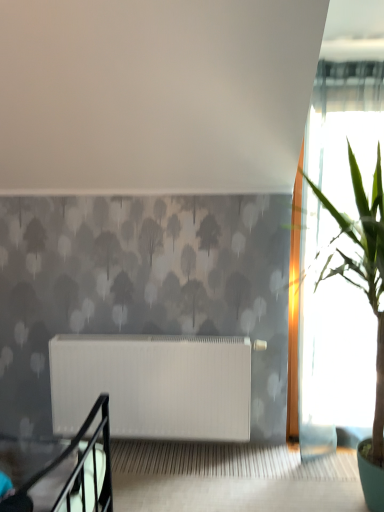
Locate an element on the screen. This screenshot has height=512, width=384. white matte radiator at center is located at coordinates (154, 385).

This screenshot has width=384, height=512. What do you see at coordinates (154, 385) in the screenshot? I see `white matte radiator at center` at bounding box center [154, 385].

This screenshot has height=512, width=384. Identify the location of green leafy plant at right. (367, 298).

The width and height of the screenshot is (384, 512). What do you see at coordinates (367, 298) in the screenshot?
I see `green leafy plant at right` at bounding box center [367, 298].

The image size is (384, 512). Find the location of `white matte radiator at center`. white matte radiator at center is located at coordinates click(154, 385).

Visually, is green leafy plant at right positioned to the left or to the right of white matte radiator at center?

green leafy plant at right is positioned on white matte radiator at center's right side.

Between green leafy plant at right and white matte radiator at center, which one is positioned in front?

green leafy plant at right is closer to the camera.

Does point (343, 255) come farther from viewer compared to point (156, 376)?

No, it is in front of (156, 376).

From the image's perspective, which one is positioned lower, green leafy plant at right or white matte radiator at center?

white matte radiator at center.

From a real-world perspective, which object rests below the other?

white matte radiator at center is physically lower.

Does green leafy plant at right have a lesser width compared to white matte radiator at center?

In fact, green leafy plant at right might be wider than white matte radiator at center.

Can you confirm if green leafy plant at right is shorter than white matte radiator at center?

In fact, green leafy plant at right may be taller than white matte radiator at center.

Considering the sizes of objects green leafy plant at right and white matte radiator at center in the image provided, who is smaller, green leafy plant at right or white matte radiator at center?

Smaller between the two is white matte radiator at center.

Is green leafy plant at right inside or outside of white matte radiator at center?

green leafy plant at right lies outside white matte radiator at center.

Are green leafy plant at right and white matte radiator at center located far from each other?

No, there isn't a large distance between green leafy plant at right and white matte radiator at center.

Does green leafy plant at right turn towards white matte radiator at center?

No, green leafy plant at right is not aimed at white matte radiator at center.

What's the angular difference between green leafy plant at right and white matte radiator at center's facing directions?

The angular difference between green leafy plant at right and white matte radiator at center is 4.98 degrees.

Locate an element on the screen. radiator below the green leafy plant at right (from a real-world perspective) is located at coordinates (154, 385).

Which is more to the right, white matte radiator at center or green leafy plant at right?

Positioned to the right is green leafy plant at right.

Which object is closer to the camera taking this photo, white matte radiator at center or green leafy plant at right?

green leafy plant at right is closer to the camera.

Does point (54, 378) come behind point (381, 436)?

Yes, it is.

From the image's perspective, is white matte radiator at center below green leafy plant at right?

Yes, from the image's perspective, white matte radiator at center is below green leafy plant at right.

From a real-world perspective, is white matte radiator at center above or below green leafy plant at right?

white matte radiator at center is below green leafy plant at right.

Is white matte radiator at center thinner than green leafy plant at right?

Yes, white matte radiator at center is thinner than green leafy plant at right.

Between white matte radiator at center and green leafy plant at right, which one has more height?

green leafy plant at right is taller.

Who is bigger, white matte radiator at center or green leafy plant at right?

green leafy plant at right is bigger.

Can we say white matte radiator at center lies outside green leafy plant at right?

That's correct, white matte radiator at center is outside of green leafy plant at right.

Is white matte radiator at center not near green leafy plant at right?

They are positioned close to each other.

Is white matte radiator at center oriented towards green leafy plant at right?

No, white matte radiator at center is not aimed at green leafy plant at right.

What's the angular difference between white matte radiator at center and green leafy plant at right's facing directions?

The angle between the facing direction of white matte radiator at center and the facing direction of green leafy plant at right is 4.98 degrees.

You are a GUI agent. You are given a task and a screenshot of the screen. Output one action in this format:
    pyautogui.click(x=<x>, y=<y>)
    Task: Click on the radiator on the left of green leafy plant at right
    This screenshot has height=512, width=384.
    Given the screenshot: What is the action you would take?
    pyautogui.click(x=154, y=385)

Identify the location of houseplant located above the white matte radiator at center (from the image's perspective). (367, 298).

Find the location of a particular element. The image size is (384, 512). radiator below the green leafy plant at right (from the image's perspective) is located at coordinates (154, 385).